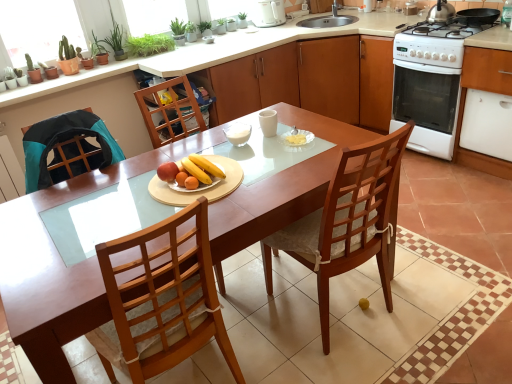
Locate an element on the screen. white glossy oven at right is located at coordinates (426, 106).

What do you see at coordinates (483, 90) in the screenshot? Image resolution: width=512 pixels, height=384 pixels. I see `white glossy oven at right, which is the first cabinetry in right-to-left order` at bounding box center [483, 90].

Measure the distance between wooden table at center and camera.

A distance of 4.64 feet exists between wooden table at center and camera.

This screenshot has width=512, height=384. What do you see at coordinates (268, 13) in the screenshot?
I see `white glossy electric kettle at upper center` at bounding box center [268, 13].

What do you see at coordinates (441, 13) in the screenshot? I see `stainless steel kettle at upper right` at bounding box center [441, 13].

Locate an element on the screen. This screenshot has width=512, height=384. smooth wooden plate with fruits at center, the second fruit dish from the right is located at coordinates (204, 190).

The image size is (512, 384). Identify the location of white glossy oven at right. (426, 106).

Which is more to the right, wooden chair at center or green leafy plant at upper left?

Positioned to the right is wooden chair at center.

Is wooden chair at center beside green leafy plant at upper left?

No.

Does white glossy oven at right, which ranks as the first cabinetry in front-to-back order, have a greater height compared to wooden cabinet at center, which ranks as the 1th cabinetry in left-to-right order?

Correct, white glossy oven at right, which ranks as the first cabinetry in front-to-back order, is much taller as wooden cabinet at center, which ranks as the 1th cabinetry in left-to-right order.

Is white glossy oven at right, which ranks as the first cabinetry in front-to-back order, turned away from wooden cabinet at center, the second cabinetry in the right-to-left sequence?

No, wooden cabinet at center, the second cabinetry in the right-to-left sequence, is not at the back of white glossy oven at right, which ranks as the first cabinetry in front-to-back order.

Which is behind, point (478, 160) or point (300, 71)?

The point (300, 71) is more distant.

Can you confirm if wooden cabinet at center, which ranks as the 1th cabinetry in left-to-right order, is shorter than white glossy oven at right, which ranks as the 2th cabinetry in back-to-front order?

Yes, wooden cabinet at center, which ranks as the 1th cabinetry in left-to-right order, is shorter than white glossy oven at right, which ranks as the 2th cabinetry in back-to-front order.

At what (x,y) coordinates should I click in order to perform the action: click on cabinetry located behind the white glossy oven at right, which ranks as the first cabinetry in front-to-back order. Please return your answer as a coordinate pair (x, y). This screenshot has width=512, height=384. Looking at the image, I should click on (312, 80).

Between wooden cabinet at center, the first cabinetry in the back-to-front sequence, and white glossy oven at right, which ranks as the second cabinetry in left-to-right order, which one has smaller width?

Thinner between the two is white glossy oven at right, which ranks as the second cabinetry in left-to-right order.

What's the angular difference between wooden cabinet at center, the first cabinetry in the back-to-front sequence, and white glossy oven at right, which is the first cabinetry in right-to-left order,'s facing directions?

0.893 degrees separate the facing orientations of wooden cabinet at center, the first cabinetry in the back-to-front sequence, and white glossy oven at right, which is the first cabinetry in right-to-left order.

Is wooden chair at center to the right of smooth wooden plate with fruits at center, which ranks as the 1th fruit dish in left-to-right order, from the viewer's perspective?

Indeed, wooden chair at center is positioned on the right side of smooth wooden plate with fruits at center, which ranks as the 1th fruit dish in left-to-right order.

Is point (319, 285) less distant than point (157, 200)?

That is False.

In terms of width, does wooden chair at center look wider or thinner when compared to smooth wooden plate with fruits at center, the second fruit dish from the right?

In the image, wooden chair at center appears to be wider than smooth wooden plate with fruits at center, the second fruit dish from the right.

From a real-world perspective, does white glossy oven at right, which ranks as the first cabinetry in front-to-back order, sit lower than wooden table at center?

No, from a real-world perspective, white glossy oven at right, which ranks as the first cabinetry in front-to-back order, is not beneath wooden table at center.

Is white glossy oven at right, which is the first cabinetry in right-to-left order, not near wooden table at center?

Indeed, white glossy oven at right, which is the first cabinetry in right-to-left order, is not near wooden table at center.

Can you confirm if white glossy oven at right, which ranks as the 2th cabinetry in back-to-front order, is smaller than wooden table at center?

Indeed, white glossy oven at right, which ranks as the 2th cabinetry in back-to-front order, has a smaller size compared to wooden table at center.

Is white glossy oven at right, which ranks as the first cabinetry in front-to-back order, located outside wooden table at center?

white glossy oven at right, which ranks as the first cabinetry in front-to-back order, lies outside wooden table at center's area.

Considering the sizes of white glossy oven at right, which is the first cabinetry in right-to-left order, and stainless steel kettle at upper right in the image, is white glossy oven at right, which is the first cabinetry in right-to-left order, bigger or smaller than stainless steel kettle at upper right?

Considering their sizes, white glossy oven at right, which is the first cabinetry in right-to-left order, takes up more space than stainless steel kettle at upper right.

Is white glossy oven at right, which is the first cabinetry in right-to-left order, next to stainless steel kettle at upper right?

There is a gap between white glossy oven at right, which is the first cabinetry in right-to-left order, and stainless steel kettle at upper right.

Does white glossy oven at right, which ranks as the first cabinetry in front-to-back order, have a greater height compared to stainless steel kettle at upper right?

Correct, white glossy oven at right, which ranks as the first cabinetry in front-to-back order, is much taller as stainless steel kettle at upper right.

Considering the positions of objects white glossy oven at right, which ranks as the second cabinetry in left-to-right order, and stainless steel kettle at upper right in the image provided, who is in front, white glossy oven at right, which ranks as the second cabinetry in left-to-right order, or stainless steel kettle at upper right?

white glossy oven at right, which ranks as the second cabinetry in left-to-right order, is more forward.

How different are the orientations of yellow matte bananas at center, the second fruit dish viewed from the left, and white glossy oven at right, which is the first cabinetry in right-to-left order, in degrees?

yellow matte bananas at center, the second fruit dish viewed from the left, and white glossy oven at right, which is the first cabinetry in right-to-left order, are facing 90.9 degrees away from each other.

Is white glossy oven at right, which is the first cabinetry in right-to-left order, at the back of yellow matte bananas at center, the first fruit dish from the right?

No, white glossy oven at right, which is the first cabinetry in right-to-left order, is not at the back of yellow matte bananas at center, the first fruit dish from the right.

Are yellow matte bananas at center, the second fruit dish viewed from the left, and white glossy oven at right, which is the first cabinetry in right-to-left order, making contact?

No, yellow matte bananas at center, the second fruit dish viewed from the left, is not beside white glossy oven at right, which is the first cabinetry in right-to-left order.

From a real-world perspective, which is physically below, yellow matte bananas at center, the second fruit dish viewed from the left, or white glossy oven at right, which ranks as the first cabinetry in front-to-back order?

white glossy oven at right, which ranks as the first cabinetry in front-to-back order, from a real-world perspective.

In order to click on plant above the wooden chair at center (from a real-world perspective) in this screenshot , I will do `click(149, 45)`.

Locate an element on the screen. The width and height of the screenshot is (512, 384). cabinetry lying in front of the wooden cabinet at center, the 2th cabinetry from the front is located at coordinates (x=483, y=90).

Considering their positions, is white glossy oven at right positioned closer to green leafy plant at upper left than smooth wooden plate with fruits at center, which ranks as the 1th fruit dish in left-to-right order?

smooth wooden plate with fruits at center, which ranks as the 1th fruit dish in left-to-right order, lies closer to green leafy plant at upper left than the other object.

Based on their spatial positions, is white glossy electric kettle at upper center or white glossy gas stove at right closer to wooden cabinet at center, the 2th cabinetry from the front?

white glossy gas stove at right is positioned closer to the anchor wooden cabinet at center, the 2th cabinetry from the front.

Considering their positions, is wooden cabinet at center, the 2th cabinetry from the front, positioned closer to smooth wooden plate with fruits at center, which ranks as the 1th fruit dish in left-to-right order, than wooden chair at center?

wooden chair at center lies closer to smooth wooden plate with fruits at center, which ranks as the 1th fruit dish in left-to-right order, than the other object.

Looking at the image, which one is located further to green leafy plant at upper left, wooden table at center or white glossy electric kettle at upper center?

wooden table at center.

Based on their spatial positions, is yellow matte bananas at center, the first fruit dish from the right, or smooth wooden plate with fruits at center, which ranks as the 1th fruit dish in left-to-right order, further from green leafy plant at upper left?

Among the two, smooth wooden plate with fruits at center, which ranks as the 1th fruit dish in left-to-right order, is located further to green leafy plant at upper left.

From the image, which object appears to be nearer to stainless steel kettle at upper right, wooden cabinet at center, which ranks as the 1th cabinetry in left-to-right order, or white glossy gas stove at right?

white glossy gas stove at right lies closer to stainless steel kettle at upper right than the other object.

From the image, which object appears to be nearer to wooden chair at center, smooth wooden plate with fruits at center, which ranks as the 1th fruit dish in left-to-right order, or wooden table at center?

wooden table at center is closer to wooden chair at center.

Consider the image. Considering their positions, is stainless steel kettle at upper right positioned further to white glossy gas stove at right than wooden chair at center?

wooden chair at center is positioned further to the anchor white glossy gas stove at right.

Locate an element on the screen. gas stove between wooden table at center and white glossy oven at right, which ranks as the 2th cabinetry in back-to-front order, from left to right is located at coordinates (435, 43).

Identify the location of gas stove between wooden cabinet at center, the 2th cabinetry from the front, and white glossy oven at right, which ranks as the first cabinetry in front-to-back order, in the horizontal direction. This screenshot has width=512, height=384. (435, 43).

Find the location of a particular element. gas stove between smooth wooden plate with fruits at center, the second fruit dish from the right, and white glossy oven at right, which ranks as the second cabinetry in left-to-right order, from left to right is located at coordinates (435, 43).

Where is `cabinetry between green leafy plant at upper left and white glossy gas stove at right from left to right`? cabinetry between green leafy plant at upper left and white glossy gas stove at right from left to right is located at coordinates (312, 80).